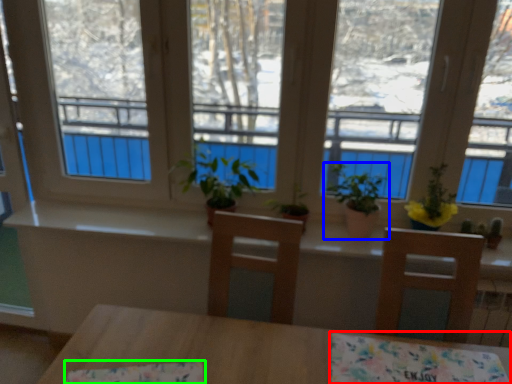
Question: Estimate the real-world distances between objects in this image. Which object is farther from tablecloth (highlighted by a red box), houseplant (highlighted by a blue box) or tablecloth (highlighted by a green box)?

Choices:
 (A) houseplant
 (B) tablecloth

Answer: (A)